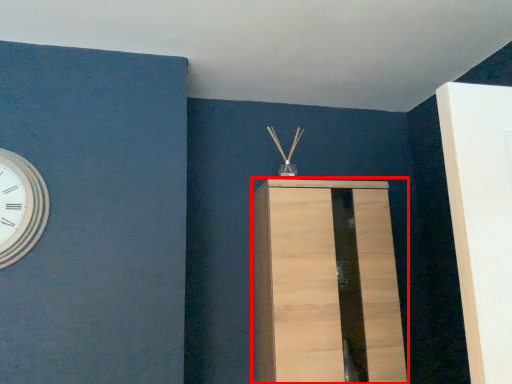
Question: From the image, what is the correct spatial relationship of furniture (annotated by the red box) in relation to wall clock?

Choices:
 (A) left
 (B) right

Answer: (B)